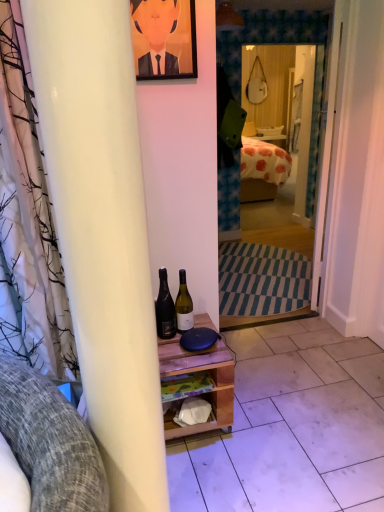
This screenshot has width=384, height=512. Identify the location of vacant space underneath white tile at lower right, positioned as the second tile in left-to-right order (from a real-world perspective). (364, 370).